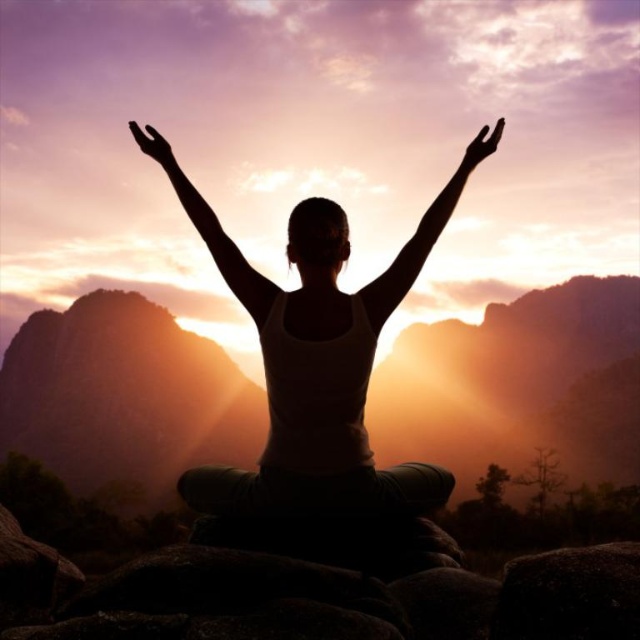
Question: Is matte brown rock at center above silhouette arm at center?

Choices:
 (A) yes
 (B) no

Answer: (B)

Question: Which point appears farthest from the camera in this image?

Choices:
 (A) (156, 140)
 (B) (481, 156)
 (C) (314, 385)

Answer: (A)

Question: Which point is farther to the camera?

Choices:
 (A) click(145, 134)
 (B) click(436, 198)
 (C) click(268, 284)

Answer: (A)

Question: Which of the following is the closest to the observer?

Choices:
 (A) silhouette yoga pose at center
 (B) transparent glass hand at upper left

Answer: (A)

Question: Does silhouette yoga pose at center appear under silhouette arm at center?

Choices:
 (A) yes
 (B) no

Answer: (A)

Question: Can you confirm if silhouette arm at upper center is thinner than black matte hand at upper right?

Choices:
 (A) no
 (B) yes

Answer: (A)